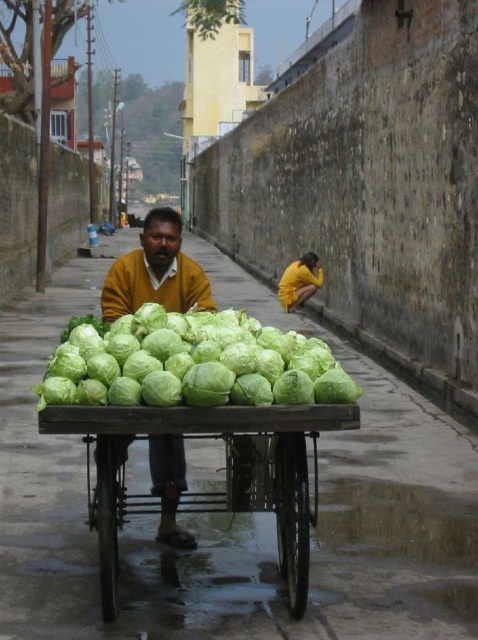
Question: Does wooden cart at center appear over yellow sweater at center?

Choices:
 (A) yes
 (B) no

Answer: (B)

Question: Which of the following is the closest to the observer?

Choices:
 (A) (143, 512)
 (B) (119, 276)
 (C) (143, 358)

Answer: (C)

Question: Estimate the real-world distances between objects in this image. Which object is closer to the green leafy cabbage at center?

Choices:
 (A) wooden cart at center
 (B) yellow sweater at center

Answer: (A)

Question: Which point appears closest to the camera in this image?

Choices:
 (A) (283, 426)
 (B) (113, 369)

Answer: (A)

Question: Does wooden cart at center have a smaller size compared to yellow sweater at center?

Choices:
 (A) no
 (B) yes

Answer: (B)

Question: Is wooden cart at center closer to the viewer compared to yellow sweater at center?

Choices:
 (A) yes
 (B) no

Answer: (A)